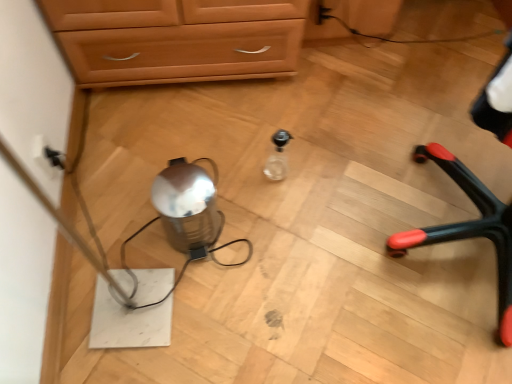
Question: Considering the relative sizes of shiny metallic kettle at center and black plastic electric outlet at left in the image provided, is shiny metallic kettle at center bigger than black plastic electric outlet at left?

Choices:
 (A) no
 (B) yes

Answer: (B)

Question: Can black plastic electric outlet at left be found inside shiny metallic kettle at center?

Choices:
 (A) no
 (B) yes

Answer: (A)

Question: Does shiny metallic kettle at center appear on the left side of black plastic electric outlet at left?

Choices:
 (A) yes
 (B) no

Answer: (B)

Question: Is shiny metallic kettle at center wider than black plastic electric outlet at left?

Choices:
 (A) no
 (B) yes

Answer: (B)

Question: Considering the relative sizes of shiny metallic kettle at center and black plastic electric outlet at left in the image provided, is shiny metallic kettle at center smaller than black plastic electric outlet at left?

Choices:
 (A) no
 (B) yes

Answer: (A)

Question: Is transparent glass bottle at center taller or shorter than shiny metallic kettle at center?

Choices:
 (A) short
 (B) tall

Answer: (A)

Question: From a real-world perspective, relative to shiny metallic kettle at center, is transparent glass bottle at center vertically above or below?

Choices:
 (A) above
 (B) below

Answer: (B)

Question: Looking at the image, does transparent glass bottle at center seem bigger or smaller compared to shiny metallic kettle at center?

Choices:
 (A) big
 (B) small

Answer: (B)

Question: Would you say transparent glass bottle at center is inside or outside shiny metallic kettle at center?

Choices:
 (A) inside
 (B) outside

Answer: (B)

Question: Is black plastic electric outlet at left inside the boundaries of black plastic chair legs at right, or outside?

Choices:
 (A) inside
 (B) outside

Answer: (B)

Question: Is point (42, 142) closer or farther from the camera than point (510, 331)?

Choices:
 (A) closer
 (B) farther

Answer: (B)

Question: Based on their sizes in the image, would you say black plastic electric outlet at left is bigger or smaller than black plastic chair legs at right?

Choices:
 (A) big
 (B) small

Answer: (B)

Question: Relative to black plastic chair legs at right, is black plastic electric outlet at left in front or behind?

Choices:
 (A) front
 (B) behind

Answer: (B)

Question: Considering the positions of black plastic chair legs at right and black plastic electric outlet at left in the image, is black plastic chair legs at right wider or thinner than black plastic electric outlet at left?

Choices:
 (A) thin
 (B) wide

Answer: (B)

Question: Based on their sizes in the image, would you say black plastic chair legs at right is bigger or smaller than black plastic electric outlet at left?

Choices:
 (A) small
 (B) big

Answer: (B)